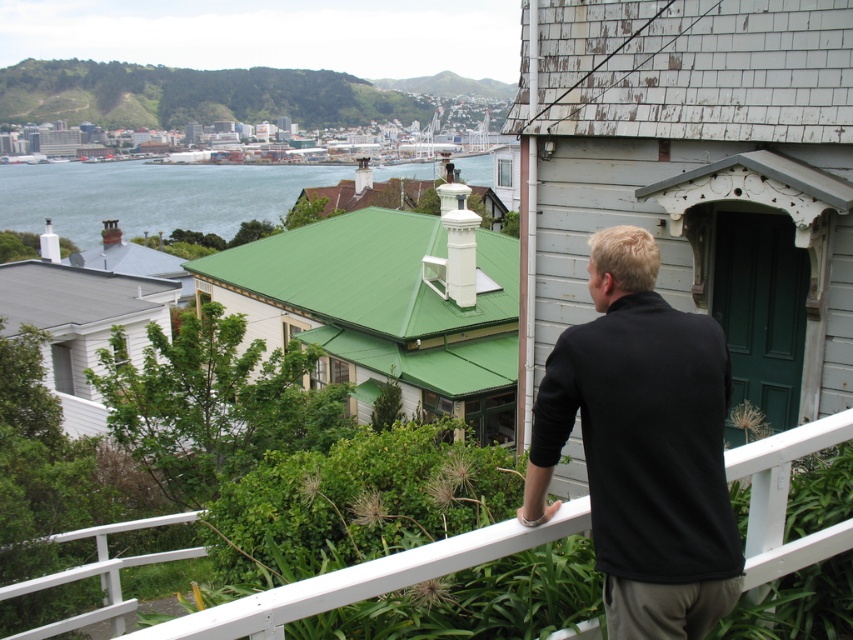
Based on the photo, you are standing on the balcony and want to take a photo of both the black matte shirt at upper right and the green water at upper left. Which object should you pan your camera to first to ensure both are in frame?

You should pan your camera to the green water at upper left first because the black matte shirt at upper right is to the right of it, so starting from the left ensures both are captured in the frame.

You are an interior designer assessing the balcony for a client who wants to add a small garden. The client mentions they want to maximize green space without obstructing the view of the coastal town. Based on the current layout, which area should they prioritize for planting? Please refer to the white painted wood at upper center and the green water at upper left in your answer.

The green water at upper left occupies more space than the white painted wood at upper center, so prioritizing the green water at upper left would allow for a larger garden area while maintaining the view of the coastal town.

You are standing on the balcony and want to place a small potted plant between the white painted wood at upper center and the green water at upper left. Which object should the plant be closer to based on their heights?

The white painted wood at upper center has a lesser height compared to green water at upper left, so the plant should be placed closer to the white painted wood at upper center to maintain balance between their heights.